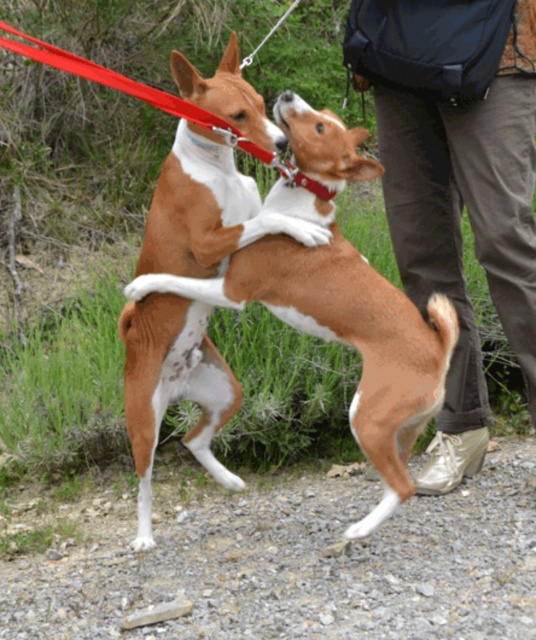
You are a photographer trying to capture the two dogs in the scene. You notice two specific points marked as point (457, 378) and point (354, 413). If you want to focus on the dog that is closer to you, which point should you aim your camera at?

Point (354, 413) is closer to you than point (457, 378), so you should aim your camera at point (354, 413) to focus on the dog that is closer.